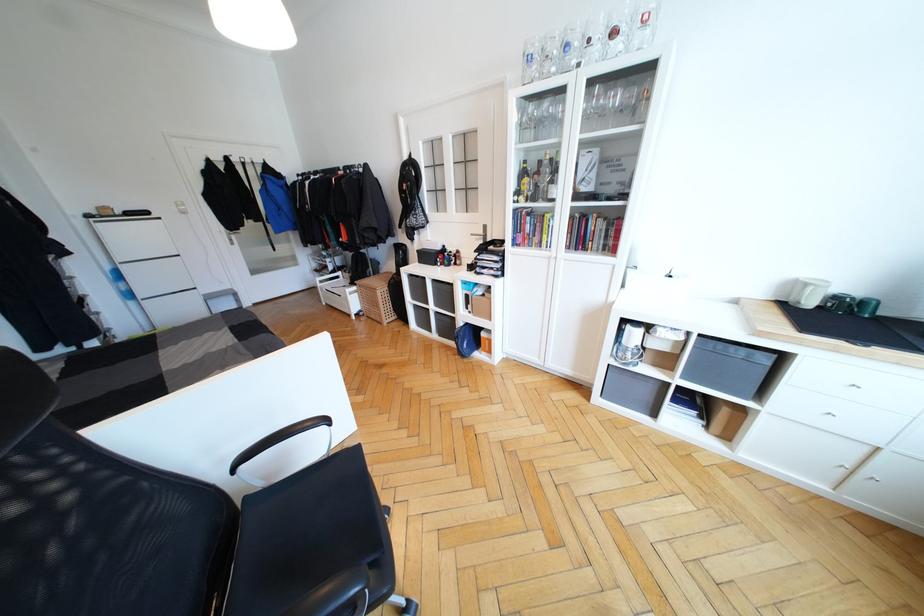
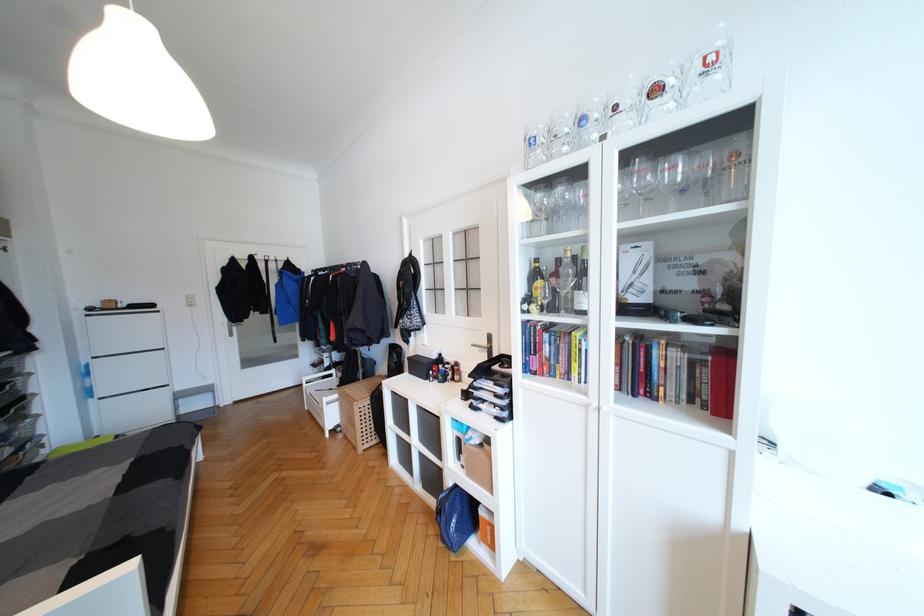
Locate, in the second image, the point that corresponds to pixel 535 110 in the first image.

(541, 197)